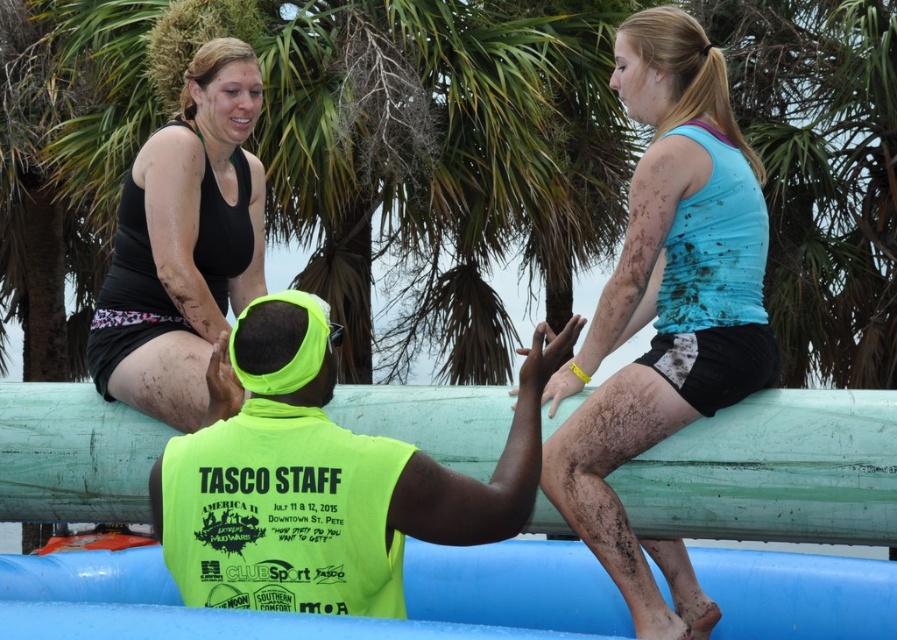
Consider the image. You are a participant in the mud run event and need to determine which clothing item is taller between the blue matte tank top at upper right and the neon yellow vest at center. Based on the scene description, which one is taller?

The blue matte tank top at upper right is taller than the neon yellow vest at center according to the description.

You are a participant in the mud run event and need to choose between the neon yellow vest at center and the neon yellow fabric safety vest at center to wear for better visibility. Which one would you choose based on their sizes?

The neon yellow vest at center is wider than the neon yellow fabric safety vest at center, so it would provide better visibility due to its larger size.

You are a participant in the mud run event and need to quickly grab either the neon yellow vest at center or the neon yellow fabric safety vest at center. Which one is closer to you?

The distance between the neon yellow vest at center and the neon yellow fabric safety vest at center is 3.94 inches, so they are very close to each other. However, since they are the same object, you can grab either one as they are part of the same vest.